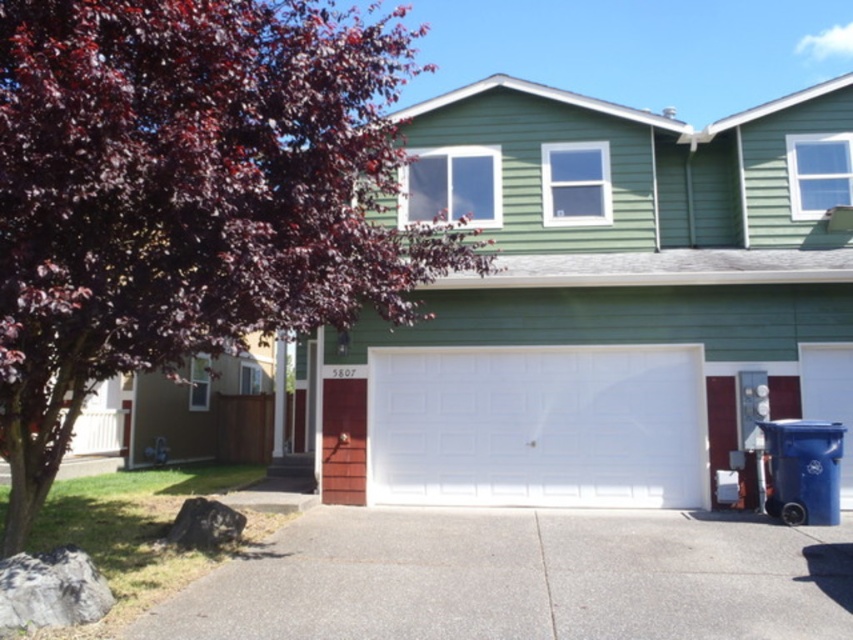
In the scene shown: You are standing in front of the house and notice two points marked in the image. The first point is at coordinates point (1, 179) and the second is at point (633, 378). Which point is nearer to your current position?

The point at coordinates point (1, 179) is closer to your current position than point (633, 378).

You are a delivery person with a 10 feet long package that needs to be placed on the driveway. Can you place the package entirely on the gray concrete driveway at lower center without overlapping the white painted wood garage door at center?

The distance between the gray concrete driveway at lower center and the white painted wood garage door at center is 12.69 feet. Since the package is only 10 feet long, there is enough space to place it entirely on the driveway without overlapping the garage door.